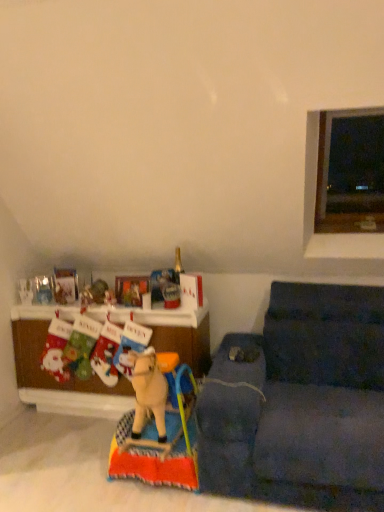
Question: Considering the positions of metallic reflective picture frame at center and dark blue fabric couch at lower right in the image, is metallic reflective picture frame at center taller or shorter than dark blue fabric couch at lower right?

Choices:
 (A) short
 (B) tall

Answer: (A)

Question: Is metallic reflective picture frame at center inside the boundaries of dark blue fabric couch at lower right, or outside?

Choices:
 (A) inside
 (B) outside

Answer: (B)

Question: Which is nearer to the wooden cabinet at lower left?

Choices:
 (A) metallic reflective picture frame at center
 (B) transparent glass window at upper right
 (C) dark blue fabric couch at lower right
 (D) matte plastic toy at left, the second toy when ordered from bottom to top
 (E) wooden horse at center, positioned as the first toy in bottom-to-top order

Answer: (A)

Question: Estimate the real-world distances between objects in this image. Which object is farther from the dark blue fabric couch at lower right?

Choices:
 (A) transparent glass window at upper right
 (B) wooden horse at center, positioned as the first toy in bottom-to-top order
 (C) wooden cabinet at lower left
 (D) metallic reflective picture frame at center
 (E) matte plastic toy at left, the second toy when ordered from bottom to top

Answer: (E)